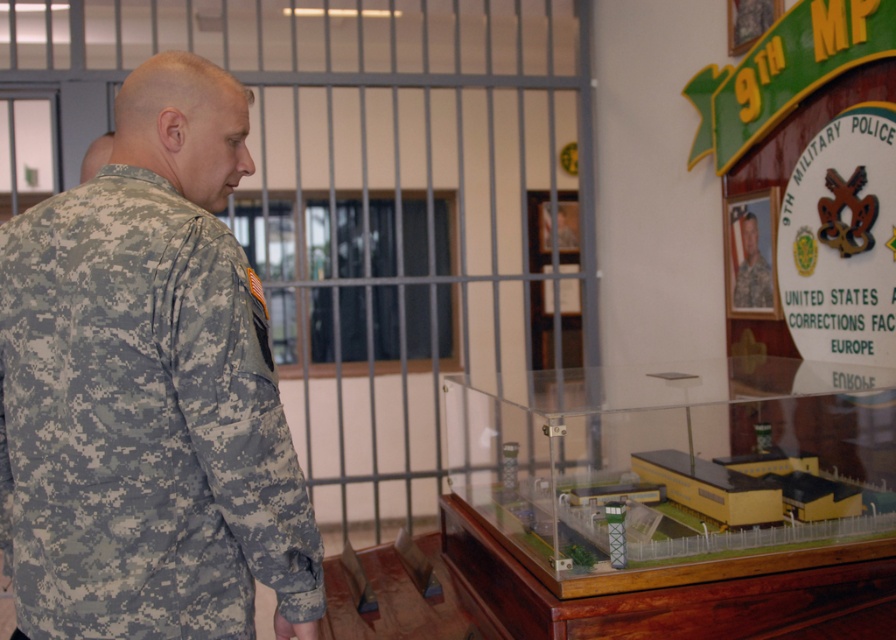
Question: Does camouflage uniform at left have a greater width compared to camouflage uniform at upper right?

Choices:
 (A) yes
 (B) no

Answer: (A)

Question: Is the position of camouflage uniform at left less distant than that of camouflage uniform at upper right?

Choices:
 (A) no
 (B) yes

Answer: (B)

Question: Is camouflage uniform at left bigger than camouflage uniform at upper right?

Choices:
 (A) no
 (B) yes

Answer: (B)

Question: Which point is farther to the camera?

Choices:
 (A) camouflage uniform at left
 (B) camouflage uniform at upper right

Answer: (B)

Question: Among these points, which one is farthest from the camera?

Choices:
 (A) (754, 230)
 (B) (314, 609)

Answer: (A)